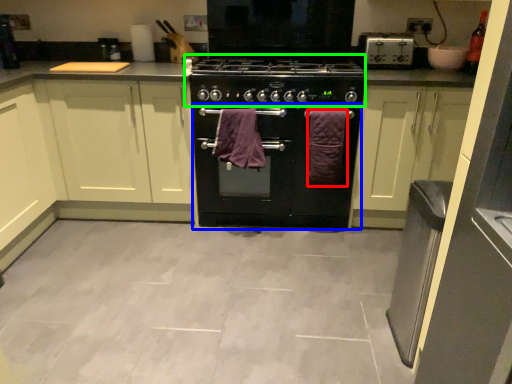
Question: Which object is positioned farthest from bath towel (highlighted by a red box)? Select from oven (highlighted by a blue box) and gas stove (highlighted by a green box).

Choices:
 (A) oven
 (B) gas stove

Answer: (B)